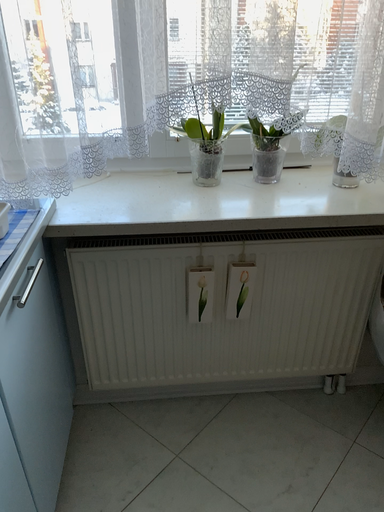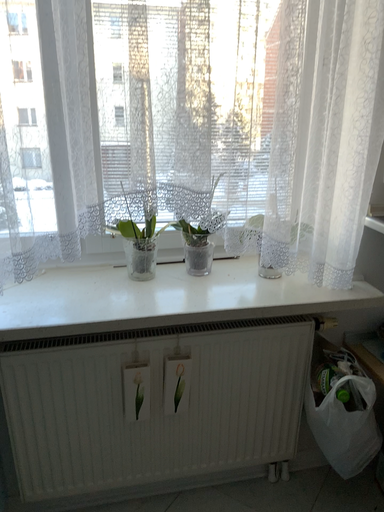
Question: How did the camera likely rotate when shooting the video?

Choices:
 (A) rotated downward
 (B) rotated upward

Answer: (B)